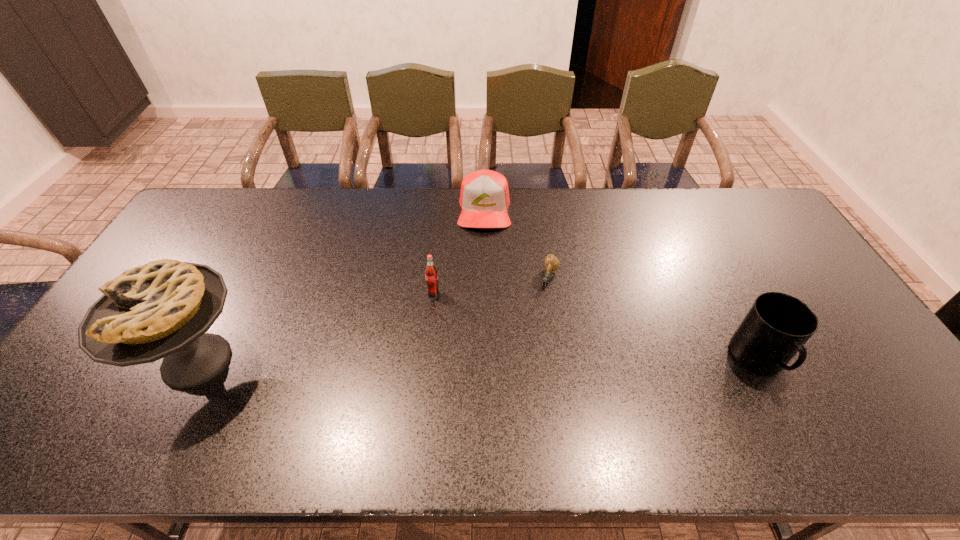
This screenshot has height=540, width=960. Identify the location of free space on the desktop that is between the tallest object and the mug and is positioned on the front-facing side of the escargot. (516, 360).

Where is `vacant space on the desktop that is between the pie and the mug and is positioned on the front-facing side of the baseball cap`? This screenshot has width=960, height=540. vacant space on the desktop that is between the pie and the mug and is positioned on the front-facing side of the baseball cap is located at coordinates (483, 360).

Locate an element on the screen. The width and height of the screenshot is (960, 540). free space on the desktop that is between the tallest object and the mug and is positioned on the label of the second object from left to right is located at coordinates (402, 360).